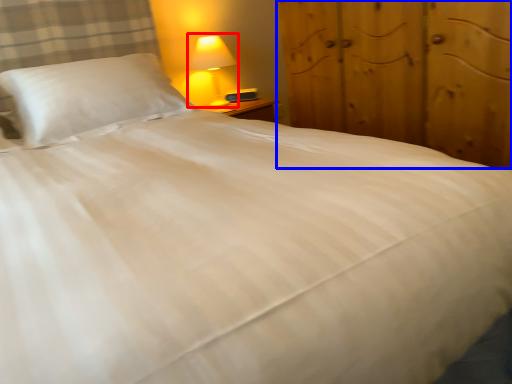
Question: Which point is closer to the camera, lamp (highlighted by a red box) or dresser (highlighted by a blue box)?

Choices:
 (A) lamp
 (B) dresser

Answer: (B)